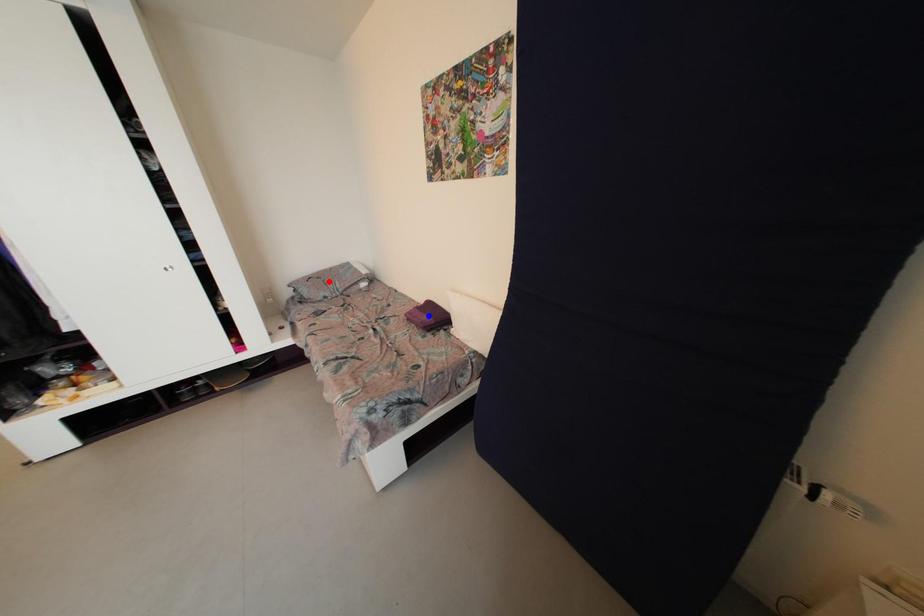
Question: Two points are marked on the image. Which point is closer to the camera?

Choices:
 (A) Blue point is closer.
 (B) Red point is closer.

Answer: (A)